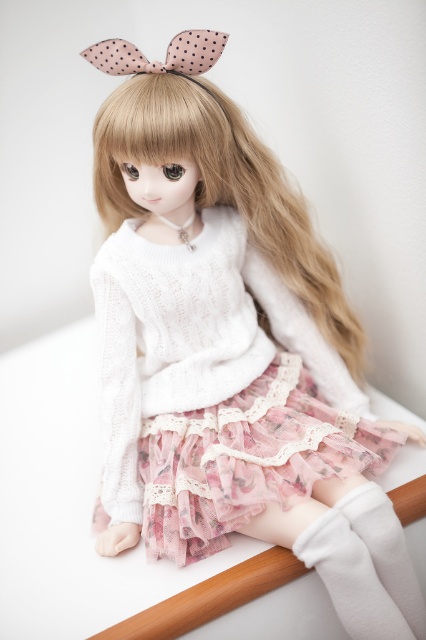
Who is more distant from viewer, (258, 301) or (155, 65)?

Point (258, 301)

Which of these two, blondehair at center or pink dotted fabric bow at upper center, stands taller?

Standing taller between the two is blondehair at center.

Between point (279, 214) and point (127, 54), which one is positioned in front?

Point (127, 54) is in front.

The image size is (426, 640). Identify the location of blondehair at center. (221, 186).